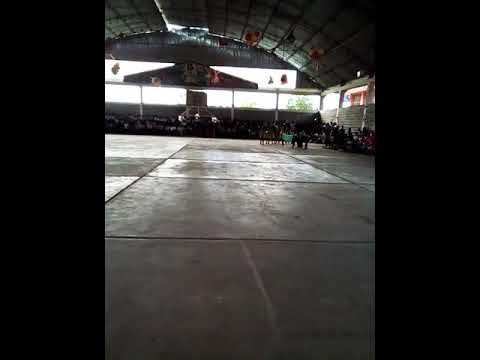
At what (x,y) coordinates should I click in order to perform the action: click on wall. Please return your answer as a coordinate pair (x, y). The height and width of the screenshot is (360, 480). Looking at the image, I should click on (351, 118).